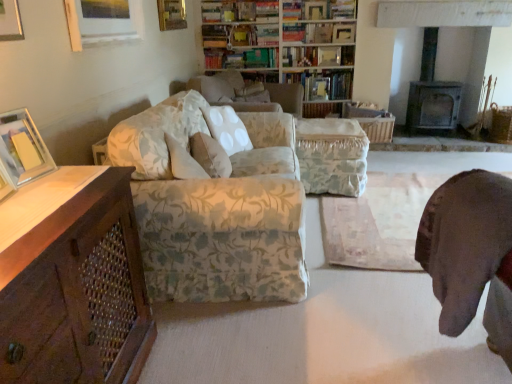
Question: Does point (351, 127) appear closer or farther from the camera than point (291, 51)?

Choices:
 (A) closer
 (B) farther

Answer: (A)

Question: From the image's perspective, is floral fabric ottoman at center positioned above or below hardcover book at upper center, which is the 3th book from bottom to top?

Choices:
 (A) above
 (B) below

Answer: (B)

Question: Considering the real-world distances, which object is farthest from the wooden picture frame at upper left, which is the third picture frame in back-to-front order?

Choices:
 (A) gold metallic picture frame at upper center, which is the second picture frame from right to left
 (B) floral fabric bookcase at upper center
 (C) fluffy white pillow at center
 (D) rusty metal grate at lower left
 (E) hardcover book at upper center, the 5th book in the top-to-bottom sequence

Answer: (E)

Question: Which is farther from the hardcover book at upper center, the second book from the top?

Choices:
 (A) hardcover book at upper center, acting as the 3th book starting from the top
 (B) rusty metal grate at lower left
 (C) fluffy white pillow at center
 (D) dark gray stone fireplace at upper right
 (E) hardcover book at upper center, which ranks as the first book in bottom-to-top order

Answer: (B)